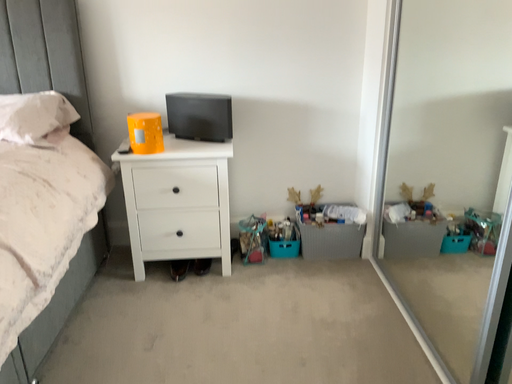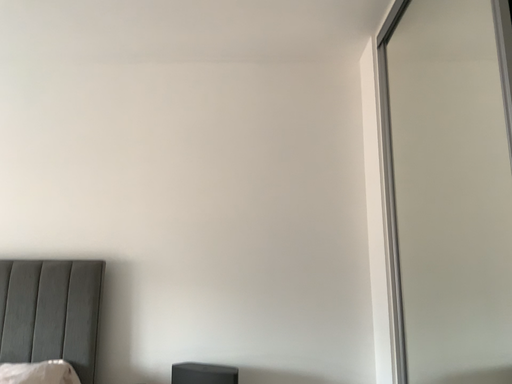
Question: How did the camera likely rotate when shooting the video?

Choices:
 (A) rotated upward
 (B) rotated downward

Answer: (A)